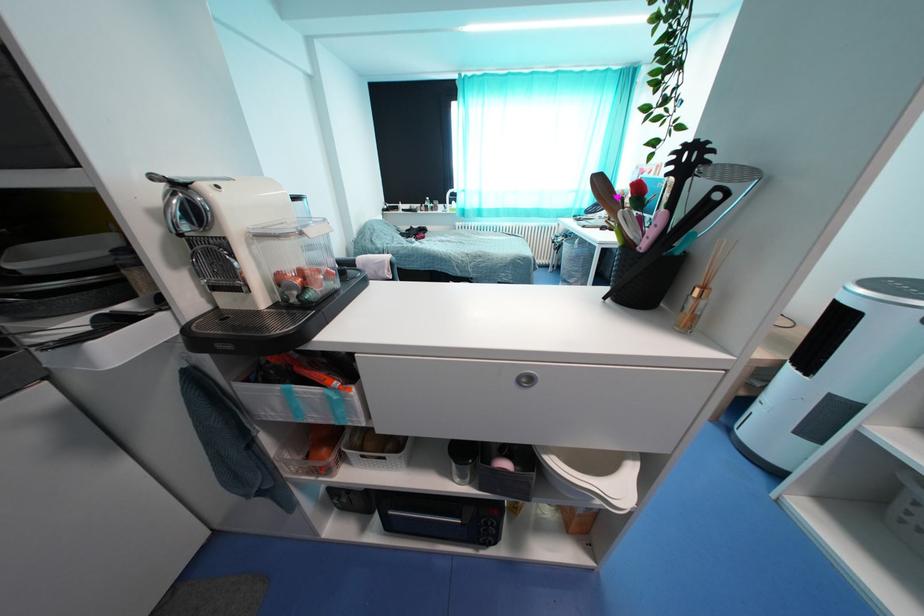
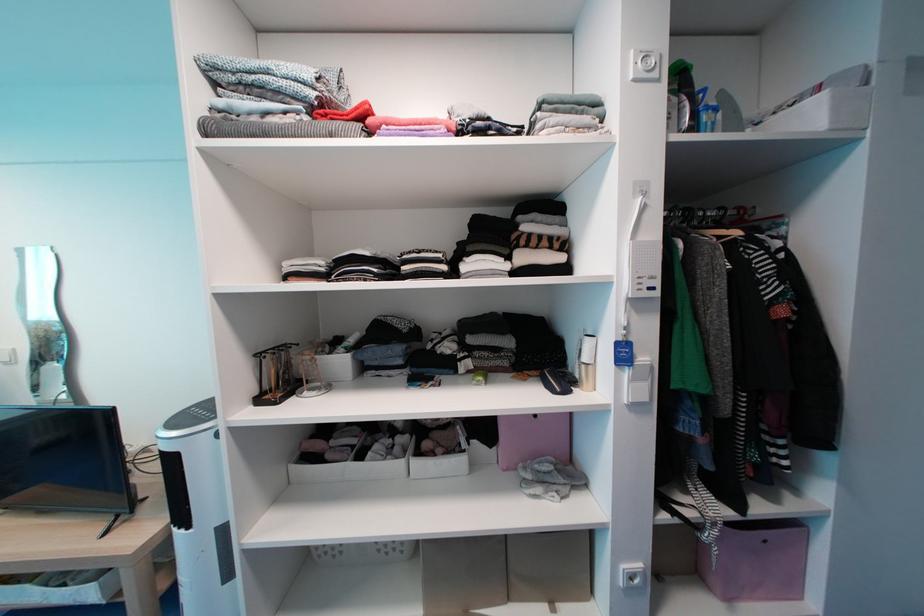
Question: The camera is either moving clockwise (left) or counter-clockwise (right) around the object. The first image is from the beginning of the video and the second image is from the end. Is the camera moving left or right when shooting the video?

Choices:
 (A) Left
 (B) Right

Answer: (A)